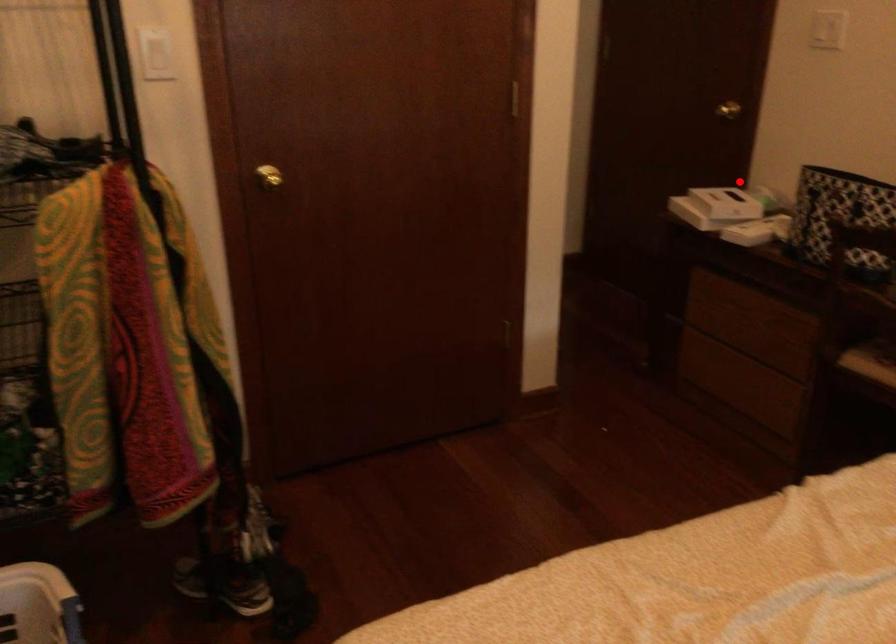
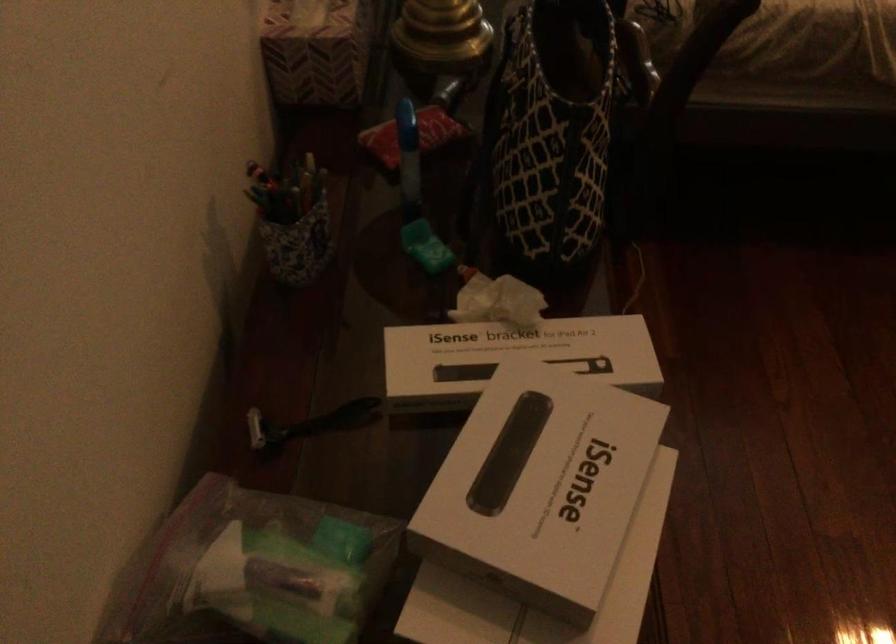
In the second image, find the point that corresponds to the highlighted location in the first image.

(252, 571)